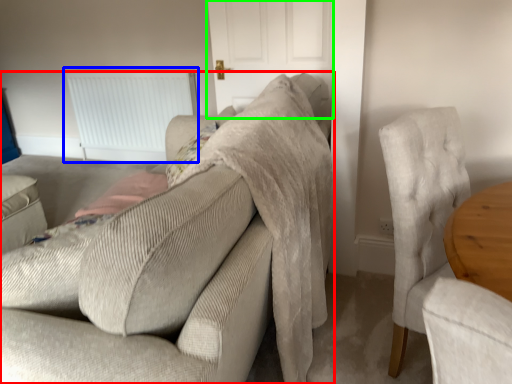
Question: Based on their relative distances, which object is nearer to studio couch (highlighted by a red box)? Choose from radiator (highlighted by a blue box) and door (highlighted by a green box).

Choices:
 (A) radiator
 (B) door

Answer: (B)